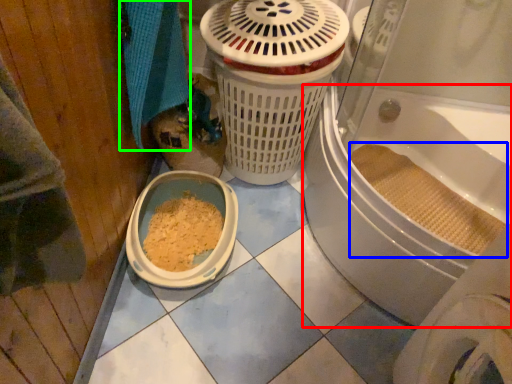
Question: Considering the real-world distances, which object is farthest from bath (highlighted by a red box)? debris (highlighted by a blue box) or bath towel (highlighted by a green box)?

Choices:
 (A) debris
 (B) bath towel

Answer: (B)